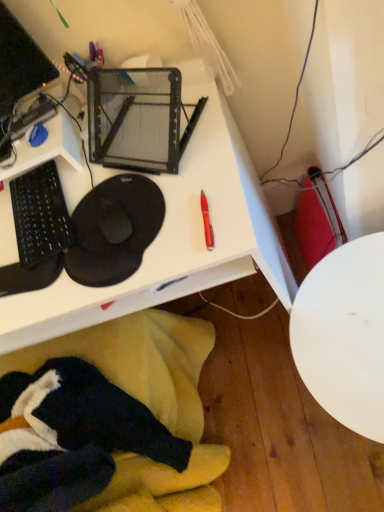
Question: Can you confirm if white glossy table at lower right is smaller than velvet-like black swivel chair at lower left?

Choices:
 (A) yes
 (B) no

Answer: (A)

Question: Are white glossy table at lower right and velvet-like black swivel chair at lower left far apart?

Choices:
 (A) no
 (B) yes

Answer: (A)

Question: Is white glossy table at lower right thinner than velvet-like black swivel chair at lower left?

Choices:
 (A) no
 (B) yes

Answer: (A)

Question: Is white glossy table at lower right taller than velvet-like black swivel chair at lower left?

Choices:
 (A) no
 (B) yes

Answer: (A)

Question: From a real-world perspective, is white glossy table at lower right below velvet-like black swivel chair at lower left?

Choices:
 (A) no
 (B) yes

Answer: (B)

Question: Is velvet-like black swivel chair at lower left at the back of white glossy table at lower right?

Choices:
 (A) no
 (B) yes

Answer: (A)

Question: Is white plastic desk at upper center in front of velvet-like black swivel chair at lower left?

Choices:
 (A) no
 (B) yes

Answer: (A)

Question: From the image's perspective, does white plastic desk at upper center appear lower than velvet-like black swivel chair at lower left?

Choices:
 (A) yes
 (B) no

Answer: (B)

Question: Can you see white plastic desk at upper center touching velvet-like black swivel chair at lower left?

Choices:
 (A) yes
 (B) no

Answer: (B)

Question: Does white plastic desk at upper center have a lesser width compared to velvet-like black swivel chair at lower left?

Choices:
 (A) no
 (B) yes

Answer: (A)

Question: From a real-world perspective, does white plastic desk at upper center stand above velvet-like black swivel chair at lower left?

Choices:
 (A) no
 (B) yes

Answer: (A)

Question: From the image's perspective, is white plastic desk at upper center on top of velvet-like black swivel chair at lower left?

Choices:
 (A) yes
 (B) no

Answer: (A)

Question: Considering the relative sizes of black matte mouse pad at left and white glossy table at lower right in the image provided, is black matte mouse pad at left smaller than white glossy table at lower right?

Choices:
 (A) yes
 (B) no

Answer: (A)